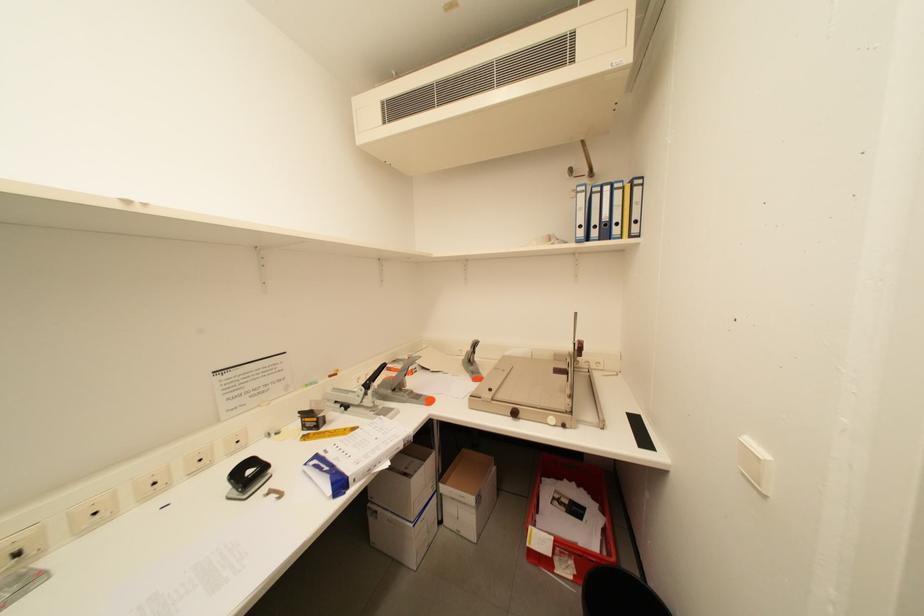
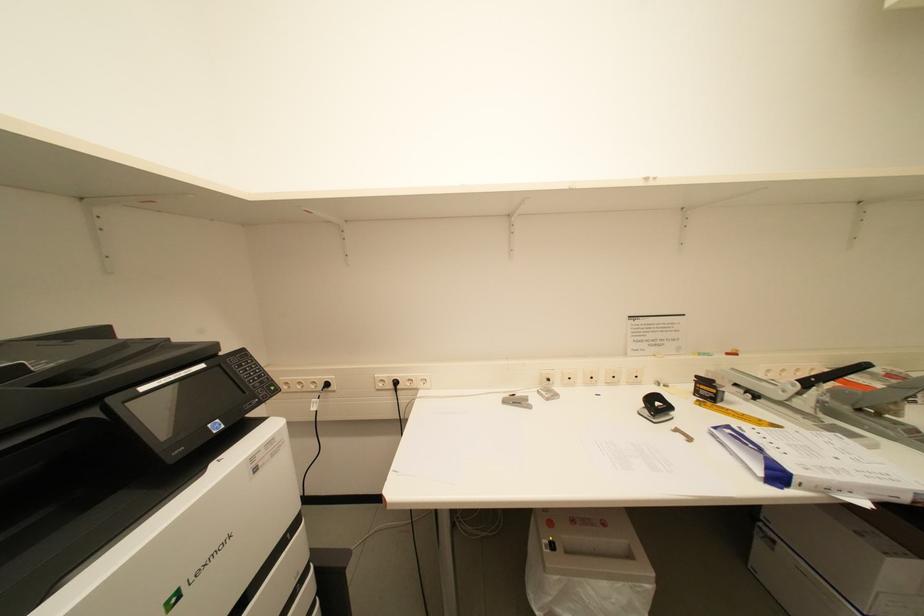
Question: The first image is from the beginning of the video and the second image is from the end. How did the camera likely rotate when shooting the video?

Choices:
 (A) Left
 (B) Right
 (C) Up
 (D) Down

Answer: (A)